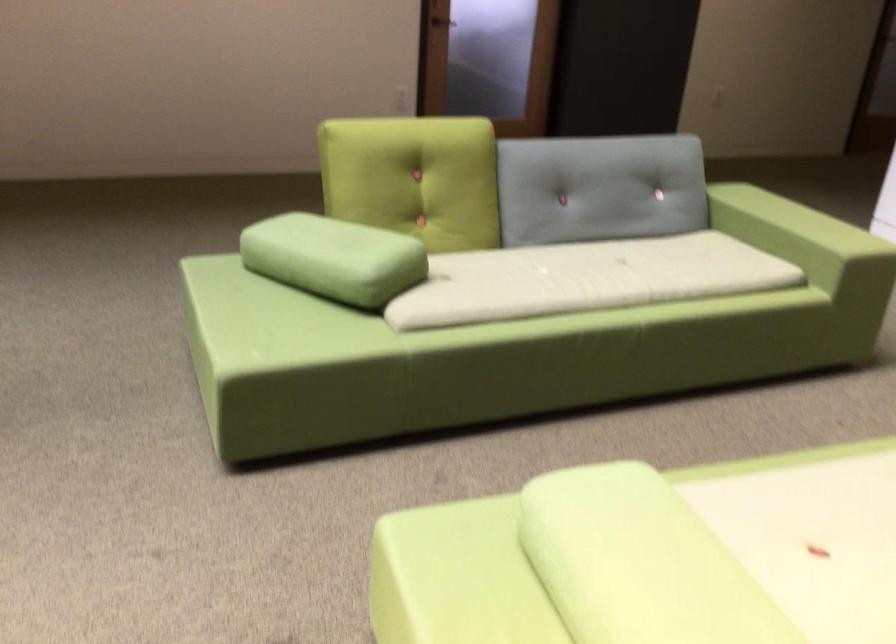
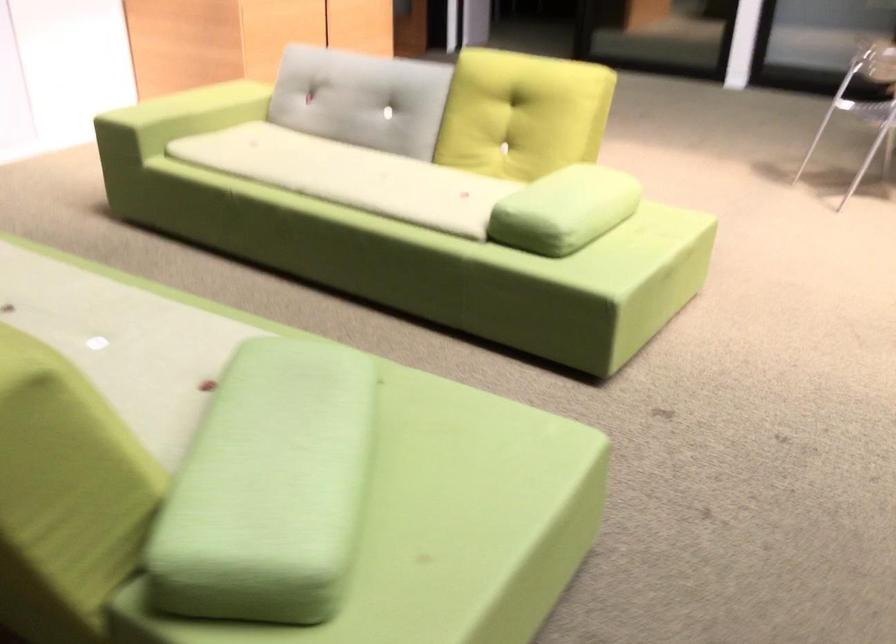
Where in the second image is the point corresponding to point (291, 222) from the first image?

(269, 488)